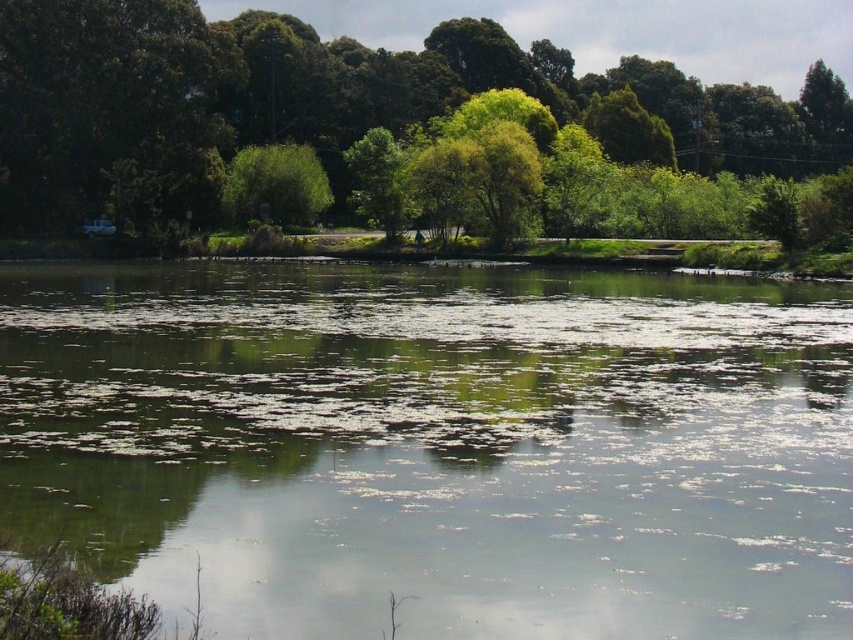
Question: Which object is closer to the camera taking this photo?

Choices:
 (A) green algae at center
 (B) green leafy tree at center

Answer: (A)

Question: Is green leafy tree at upper center closer to camera compared to green leafy tree at center?

Choices:
 (A) no
 (B) yes

Answer: (B)

Question: Which object appears farthest from the camera in this image?

Choices:
 (A) green algae at center
 (B) green leafy tree at upper center

Answer: (B)

Question: Does green leafy tree at upper center appear under green leafy tree at center?

Choices:
 (A) yes
 (B) no

Answer: (B)

Question: Among these objects, which one is farthest from the camera?

Choices:
 (A) green algae at center
 (B) green leafy tree at upper center

Answer: (B)

Question: Can you confirm if green algae at center is smaller than green leafy tree at center?

Choices:
 (A) no
 (B) yes

Answer: (A)